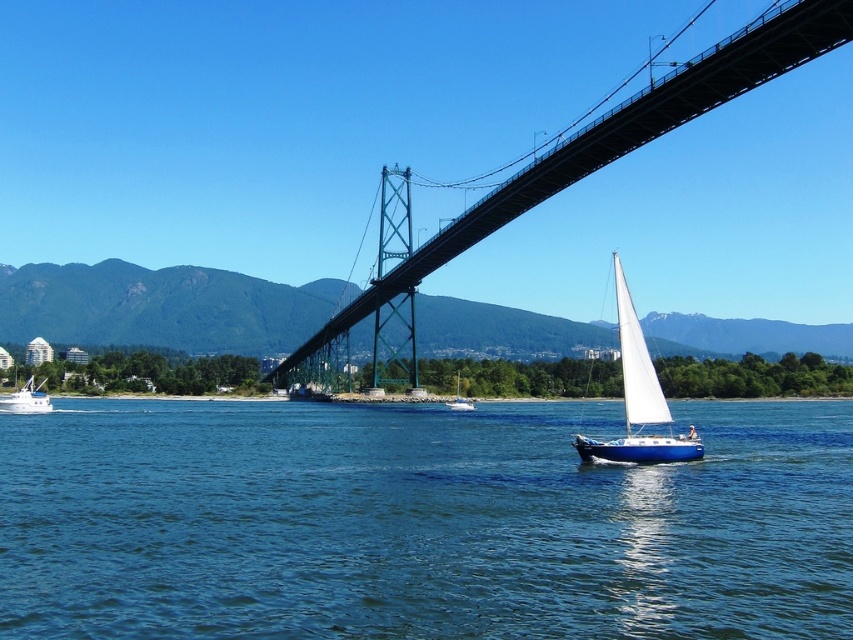
Is green metallic bridge at upper center smaller than white plastic boat at lower left?

Actually, green metallic bridge at upper center might be larger than white plastic boat at lower left.

Which is more to the right, green metallic bridge at upper center or white plastic boat at lower left?

From the viewer's perspective, green metallic bridge at upper center appears more on the right side.

Between point (605, 138) and point (25, 385), which one is positioned behind?

Positioned behind is point (25, 385).

At what (x,y) coordinates should I click in order to perform the action: click on green metallic bridge at upper center. Please return your answer as a coordinate pair (x, y). The width and height of the screenshot is (853, 640). Looking at the image, I should click on (612, 144).

Can you confirm if green metallic bridge at upper center is thinner than white sailboat at center?

No, green metallic bridge at upper center is not thinner than white sailboat at center.

Who is more distant from viewer, (544, 160) or (457, 376)?

Positioned behind is point (457, 376).

Is point (440, 257) positioned behind point (465, 404)?

Yes, it is.

At what (x,y) coordinates should I click in order to perform the action: click on green metallic bridge at upper center. Please return your answer as a coordinate pair (x, y). This screenshot has width=853, height=640. Looking at the image, I should click on (612, 144).

Can you confirm if white plastic boat at lower left is shorter than white sailboat at center?

Incorrect, white plastic boat at lower left's height does not fall short of white sailboat at center's.

Where is `white plastic boat at lower left`? This screenshot has height=640, width=853. white plastic boat at lower left is located at coordinates (26, 400).

Find the location of `white plastic boat at lower left`. white plastic boat at lower left is located at coordinates (26, 400).